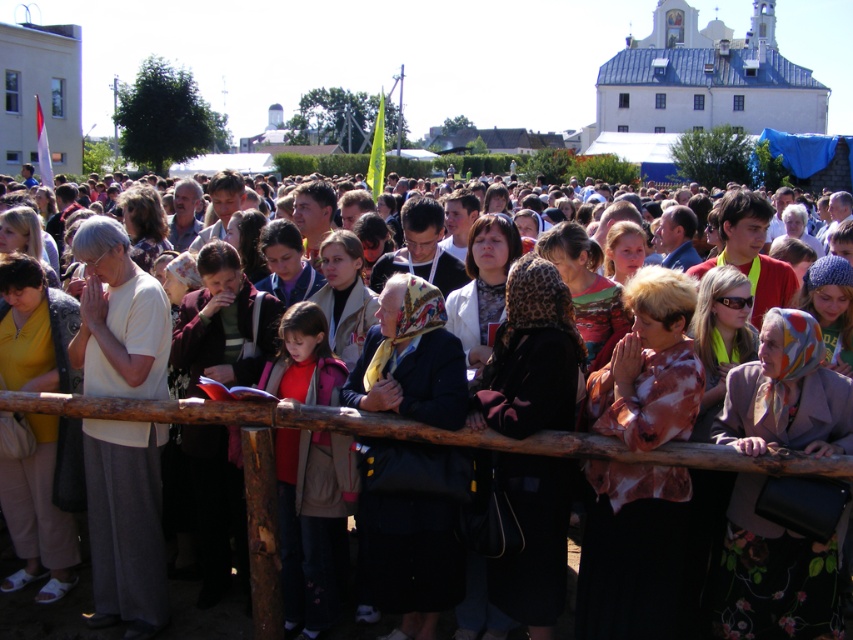
You are a photographer standing at the back of the crowd, and you want to take a photo of the dark blue fabric coat at center. Considering your camera has a maximum focus range of 100 feet, will you be able to capture the coat clearly?

The dark blue fabric coat at center is 113.74 feet away from the camera. Since the camera can only focus up to 100 feet, you won cannot capture the coat clearly.

You are standing at point (125,524) in the image. What is the color of the shirt of the person closest to you?

The white matte shirt at left is located at point (125,524), so the closest shirt to you at that point is white.